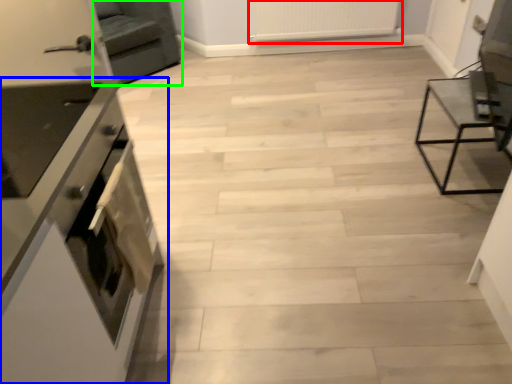
Question: Estimate the real-world distances between objects in this image. Which object is closer to radiator (highlighted by a red box), cabinetry (highlighted by a blue box) or armchair (highlighted by a green box)?

Choices:
 (A) cabinetry
 (B) armchair

Answer: (B)